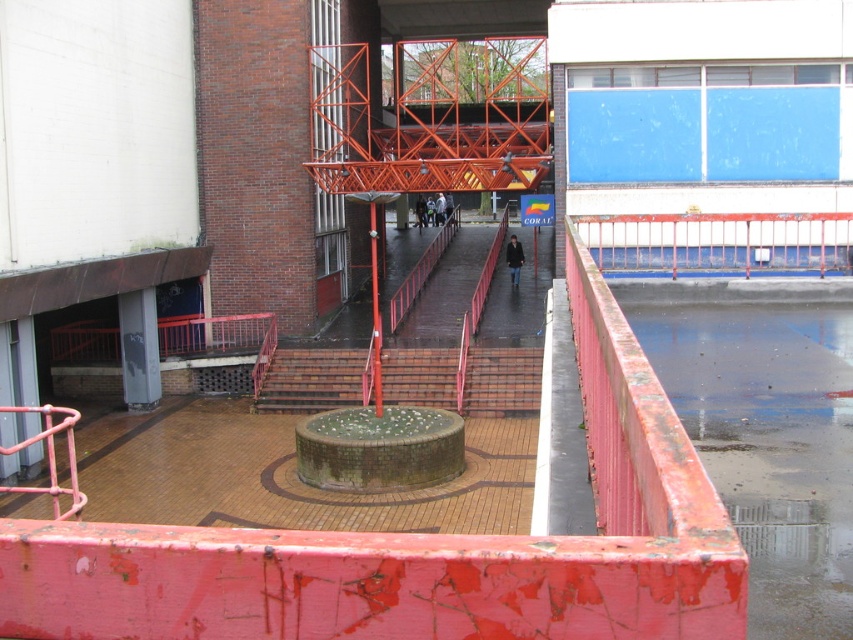
Question: Which point is closer to the camera?

Choices:
 (A) (720, 248)
 (B) (334, 394)
 (C) (558, 593)
 (D) (543, 38)

Answer: (C)

Question: In this image, where is orange metallic fire escape at center located relative to brick stairs at center?

Choices:
 (A) right
 (B) left

Answer: (A)

Question: Is rusty metal railing at center closer to the viewer compared to brick stairs at center?

Choices:
 (A) no
 (B) yes

Answer: (B)

Question: Considering the real-world distances, which object is closest to the rusty metal railing at center?

Choices:
 (A) brick stairs at center
 (B) orange metallic fire escape at center

Answer: (A)

Question: Which of the following is the farthest from the observer?

Choices:
 (A) rusty metal railing at upper right
 (B) brick stairs at center

Answer: (B)

Question: Is orange metallic fire escape at center to the left of brick stairs at center from the viewer's perspective?

Choices:
 (A) no
 (B) yes

Answer: (A)